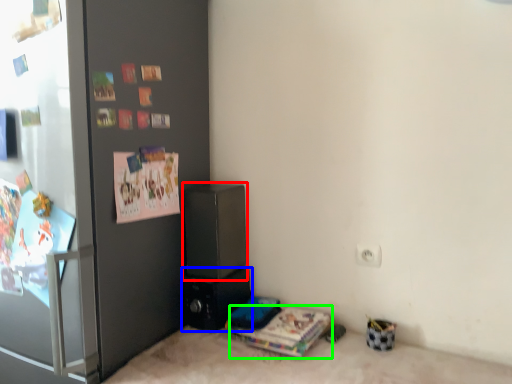
Question: Estimate the real-world distances between objects in this image. Which object is farther from appliance (highlighted by a red box), appliance (highlighted by a blue box) or magazine (highlighted by a green box)?

Choices:
 (A) appliance
 (B) magazine

Answer: (B)